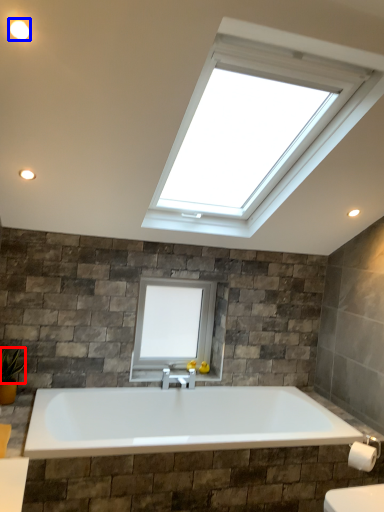
Question: Which object appears closest to the camera in this image, plant (highlighted by a red box) or lighting (highlighted by a blue box)?

Choices:
 (A) plant
 (B) lighting

Answer: (B)